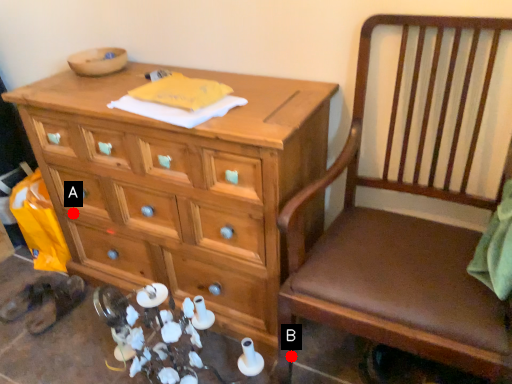
Question: Two points are circled on the image, labeled by A and B beside each circle. Which point is closer to the camera taking this photo?

Choices:
 (A) A is closer
 (B) B is closer

Answer: (B)